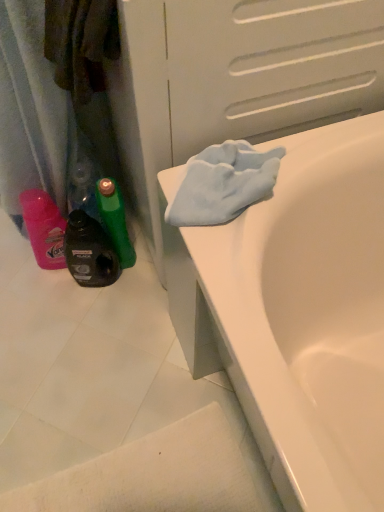
Identify the location of vacant space to the right of black plastic bottle at lower left. (142, 294).